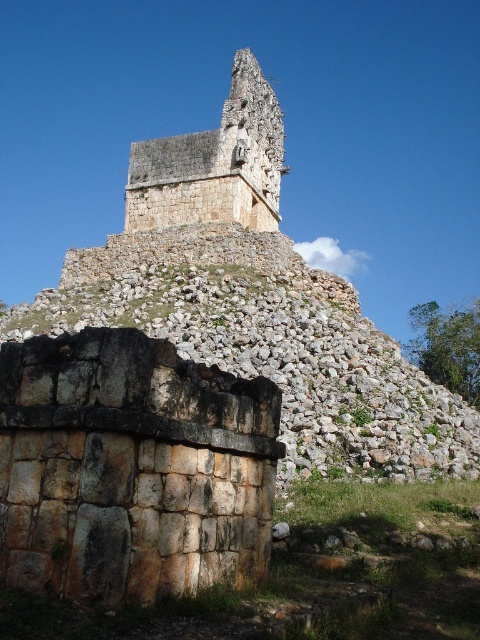
Which is more to the right, rustic stone wall at lower left or rough stone structure at upper center?

Positioned to the right is rough stone structure at upper center.

The image size is (480, 640). Describe the element at coordinates (131, 468) in the screenshot. I see `rustic stone wall at lower left` at that location.

Find the location of a particular element. rustic stone wall at lower left is located at coordinates (131, 468).